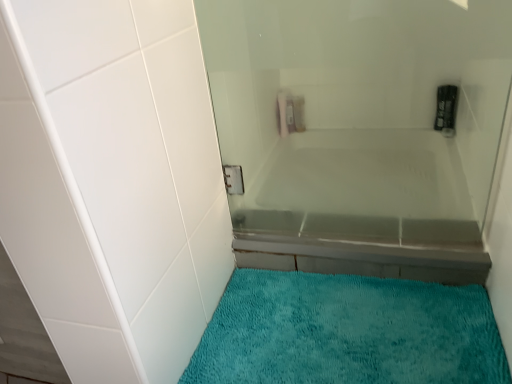
Describe the element at coordinates (348, 332) in the screenshot. I see `teal plush bath mat at lower center` at that location.

Identify the location of teal plush bath mat at lower center. (348, 332).

Describe the element at coordinates (359, 131) in the screenshot. I see `white glossy bathtub at center` at that location.

The height and width of the screenshot is (384, 512). I want to click on white glossy bathtub at center, so click(359, 131).

Locate an element on the screen. teal plush bath mat at lower center is located at coordinates (348, 332).

Looking at this image, is teal plush bath mat at lower center to the left or to the right of white glossy bathtub at center in the image?

teal plush bath mat at lower center is to the left of white glossy bathtub at center.

Between teal plush bath mat at lower center and white glossy bathtub at center, which one is positioned in front?

teal plush bath mat at lower center is in front.

Does point (471, 360) appear closer or farther from the camera than point (359, 226)?

Point (471, 360) is closer to the camera than point (359, 226).

From the image's perspective, is teal plush bath mat at lower center above or below white glossy bathtub at center?

Based on their image positions, teal plush bath mat at lower center is located beneath white glossy bathtub at center.

From a real-world perspective, who is located higher, teal plush bath mat at lower center or white glossy bathtub at center?

From a 3D spatial view, white glossy bathtub at center is above.

Considering the sizes of teal plush bath mat at lower center and white glossy bathtub at center in the image, is teal plush bath mat at lower center wider or thinner than white glossy bathtub at center?

teal plush bath mat at lower center is wider than white glossy bathtub at center.

Considering the relative sizes of teal plush bath mat at lower center and white glossy bathtub at center in the image provided, is teal plush bath mat at lower center shorter than white glossy bathtub at center?

Yes.

Who is bigger, teal plush bath mat at lower center or white glossy bathtub at center?

white glossy bathtub at center.

Do you think teal plush bath mat at lower center is within white glossy bathtub at center, or outside of it?

teal plush bath mat at lower center is outside white glossy bathtub at center.

Is teal plush bath mat at lower center next to white glossy bathtub at center?

teal plush bath mat at lower center and white glossy bathtub at center are not in contact.

Could you tell me if teal plush bath mat at lower center is facing white glossy bathtub at center?

No, teal plush bath mat at lower center is not facing towards white glossy bathtub at center.

What's the angular difference between teal plush bath mat at lower center and white glossy bathtub at center's facing directions?

The angle between the facing direction of teal plush bath mat at lower center and the facing direction of white glossy bathtub at center is 0.693 degrees.

Where is `bath mat lying in front of the white glossy bathtub at center`? The width and height of the screenshot is (512, 384). bath mat lying in front of the white glossy bathtub at center is located at coordinates (348, 332).

Can you confirm if white glossy bathtub at center is positioned to the right of teal plush bath mat at lower center?

Indeed, white glossy bathtub at center is positioned on the right side of teal plush bath mat at lower center.

Does white glossy bathtub at center lie behind teal plush bath mat at lower center?

Yes, it is.

Considering the positions of point (371, 25) and point (358, 331), is point (371, 25) closer or farther from the camera than point (358, 331)?

Point (371, 25) appears to be closer to the viewer than point (358, 331).

From the image's perspective, relative to teal plush bath mat at lower center, is white glossy bathtub at center above or below?

Based on their image positions, white glossy bathtub at center is located above teal plush bath mat at lower center.

From a real-world perspective, is white glossy bathtub at center physically located above or below teal plush bath mat at lower center?

white glossy bathtub at center is above teal plush bath mat at lower center.

Can you confirm if white glossy bathtub at center is wider than teal plush bath mat at lower center?

No.

Can you confirm if white glossy bathtub at center is shorter than teal plush bath mat at lower center?

In fact, white glossy bathtub at center may be taller than teal plush bath mat at lower center.

Based on the photo, which of these two, white glossy bathtub at center or teal plush bath mat at lower center, is bigger?

With larger size is white glossy bathtub at center.

Is teal plush bath mat at lower center located within white glossy bathtub at center?

Actually, teal plush bath mat at lower center is outside white glossy bathtub at center.

Is white glossy bathtub at center placed right next to teal plush bath mat at lower center?

No, white glossy bathtub at center is not next to teal plush bath mat at lower center.

Is white glossy bathtub at center positioned with its back to teal plush bath mat at lower center?

No, teal plush bath mat at lower center is not at the back of white glossy bathtub at center.

How many degrees apart are the facing directions of white glossy bathtub at center and teal plush bath mat at lower center?

There is a 0.693-degree angle between the facing directions of white glossy bathtub at center and teal plush bath mat at lower center.

Where is `bath mat in front of the white glossy bathtub at center`? This screenshot has width=512, height=384. bath mat in front of the white glossy bathtub at center is located at coordinates (348, 332).

What are the coordinates of `bath mat below the white glossy bathtub at center (from the image's perspective)` in the screenshot? It's located at (348, 332).

Find the location of `bath lying on the right of teal plush bath mat at lower center`. bath lying on the right of teal plush bath mat at lower center is located at coordinates pyautogui.click(x=359, y=131).